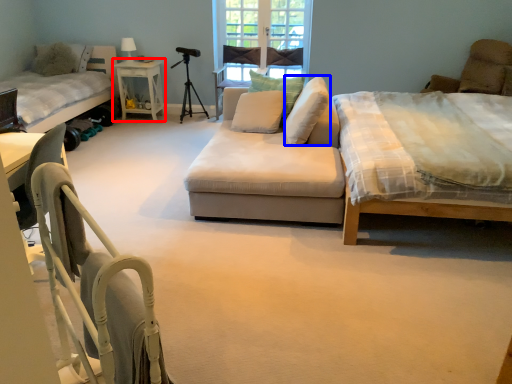
Question: Which of the following is the closest to the observer, table (highlighted by a red box) or pillow (highlighted by a blue box)?

Choices:
 (A) table
 (B) pillow

Answer: (B)